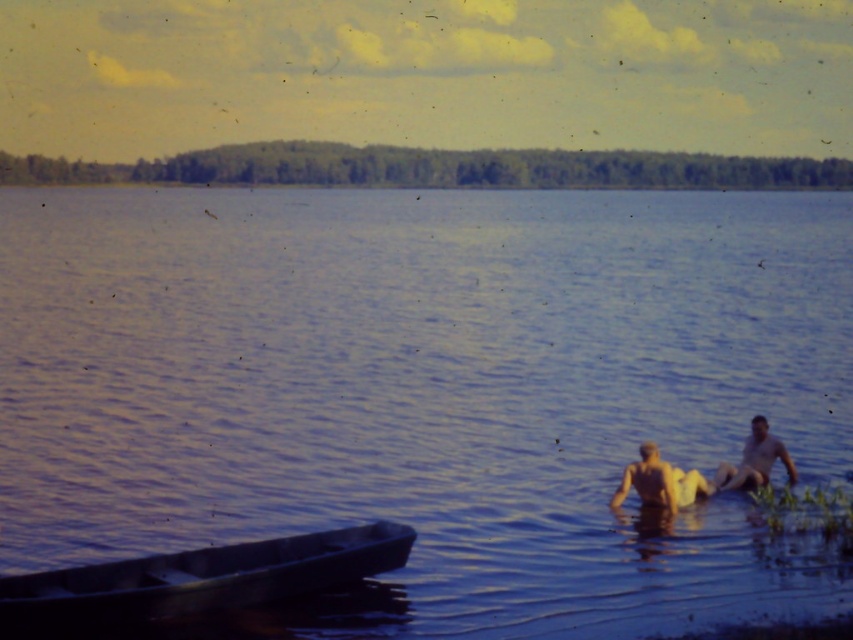
You are a photographer standing at the lakeside. You want to take a photo of the blue water at center and the skinny yellow swimwear at lower right. Based on their positions, which object is closer to you?

The blue water at center is closer to you because it is in front of the skinny yellow swimwear at lower right.